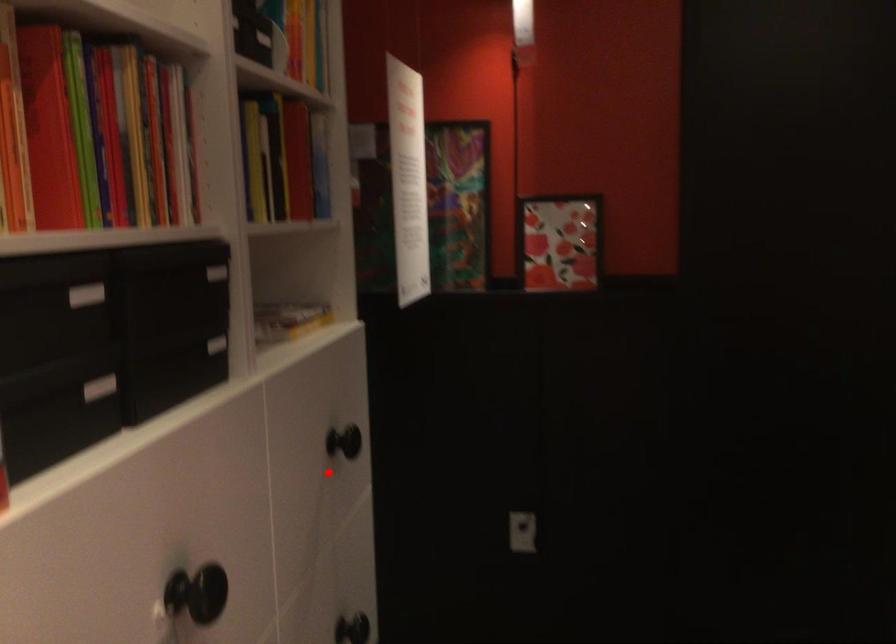
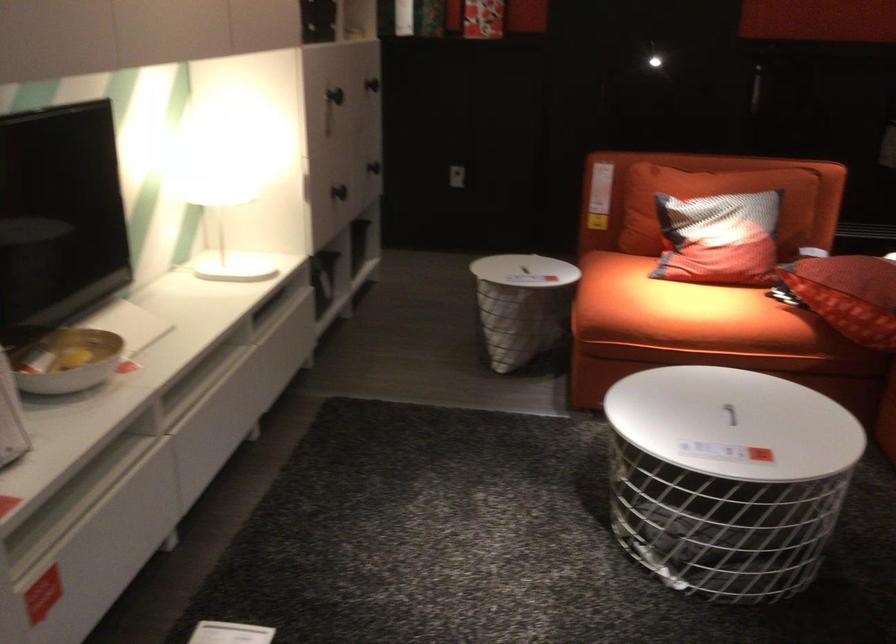
Where in the second image is the point corresponding to the highlighted location from the first image?

(372, 84)